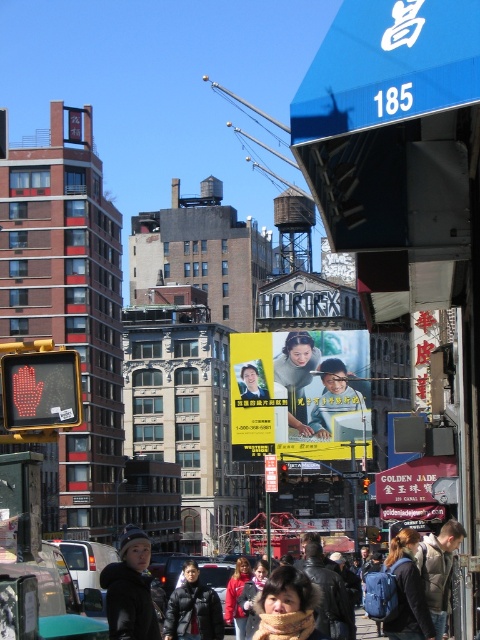
Question: Among these objects, which one is farthest from the camera?

Choices:
 (A) dark blue backpack at center
 (B) leather jacket at center

Answer: (A)

Question: Can you confirm if dark blue backpack at center is wider than red jacket at center?

Choices:
 (A) yes
 (B) no

Answer: (A)

Question: Does leather jacket at center appear on the left side of matte black jacket at center?

Choices:
 (A) no
 (B) yes

Answer: (A)

Question: Does black matte jacket at lower left lie behind dark gray jacket at center?

Choices:
 (A) yes
 (B) no

Answer: (B)

Question: Which object is positioned closest to the black matte jacket at lower left?

Choices:
 (A) yellow paper advertisement at center
 (B) dark gray jacket at center

Answer: (B)

Question: Estimate the real-world distances between objects in this image. Which object is closer to the brown fuzzy scarf at center?

Choices:
 (A) dark gray jacket at center
 (B) dark blue backpack at center

Answer: (B)